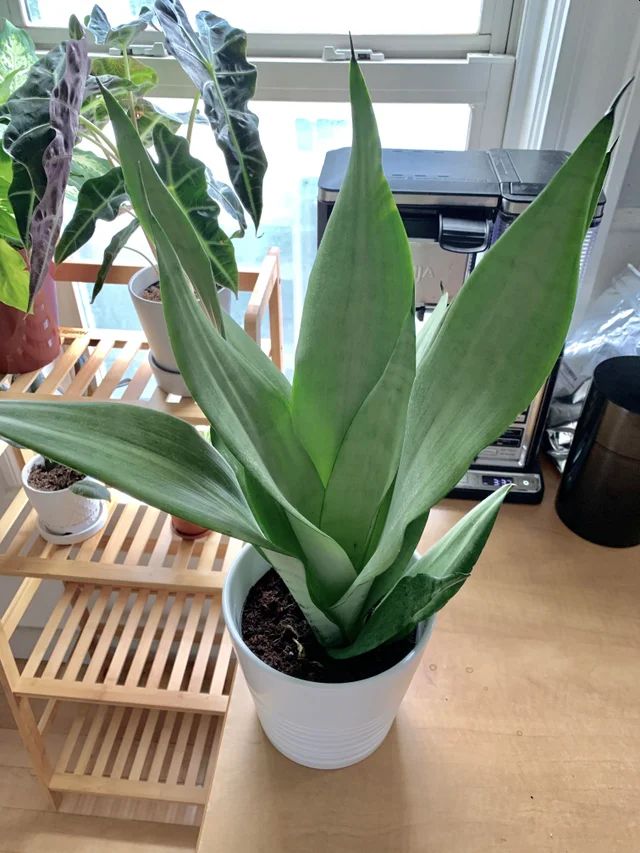
Identify the location of digital clock on coffee machine. Image resolution: width=640 pixels, height=853 pixels. (492, 482).